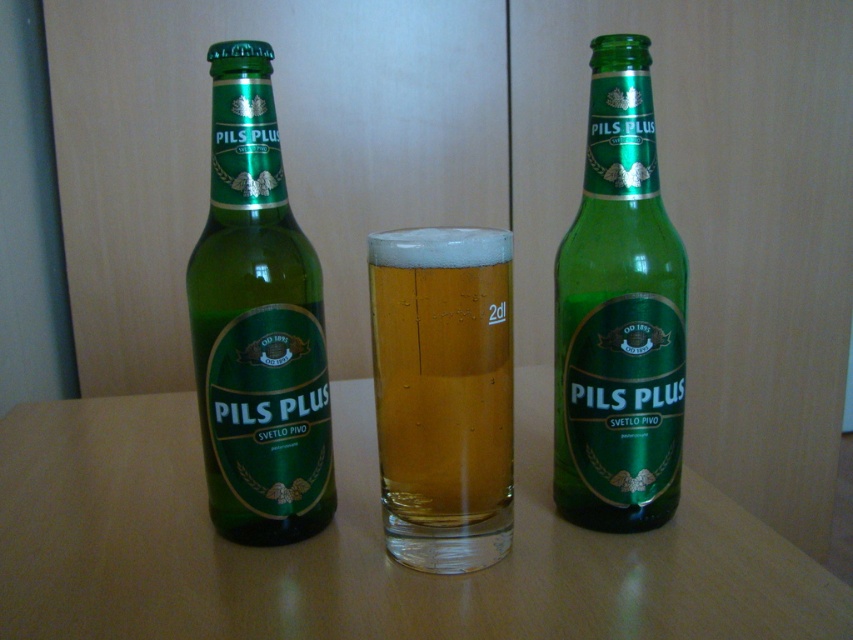
In the scene shown: Is green glass table at center closer to the viewer compared to green glass bottle at left?

Yes, green glass table at center is in front of green glass bottle at left.

The height and width of the screenshot is (640, 853). I want to click on green glass table at center, so click(358, 547).

Between green glass bottle at left and translucent glass at center, which one has less height?

translucent glass at center

Can you confirm if green glass bottle at left is taller than translucent glass at center?

Correct, green glass bottle at left is much taller as translucent glass at center.

The image size is (853, 640). Find the location of `green glass bottle at left`. green glass bottle at left is located at coordinates (257, 323).

Is green glass table at center wider than green glass bottle at center?

Yes.

Does green glass table at center appear under green glass bottle at center?

Yes.

Locate an element on the screen. green glass table at center is located at coordinates (358, 547).

This screenshot has width=853, height=640. Identify the location of green glass table at center. (358, 547).